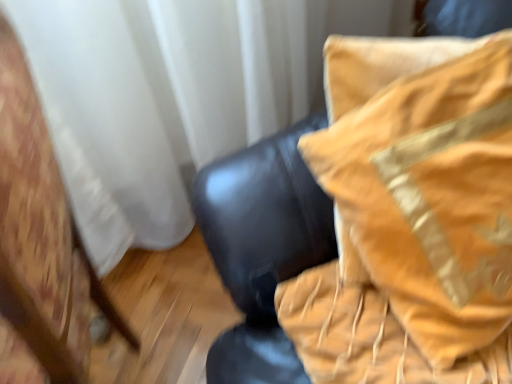
Question: In the image, is wooden chair at left, which is the 2th furniture in right-to-left order, on the left side or the right side of velvet gold pillow at upper right, the 2th furniture when ordered from left to right?

Choices:
 (A) right
 (B) left

Answer: (B)

Question: Looking at the image, does wooden chair at left, which is the 2th furniture in right-to-left order, seem bigger or smaller compared to velvet gold pillow at upper right, the first furniture from the right?

Choices:
 (A) small
 (B) big

Answer: (B)

Question: Considering the positions of wooden chair at left, placed as the 1th furniture when sorted from left to right, and velvet gold pillow at upper right, the first furniture from the right, in the image, is wooden chair at left, placed as the 1th furniture when sorted from left to right, wider or thinner than velvet gold pillow at upper right, the first furniture from the right,?

Choices:
 (A) thin
 (B) wide

Answer: (B)

Question: Is velvet gold pillow at upper right, the first furniture from the right, bigger or smaller than wooden chair at left, which is the 2th furniture in right-to-left order?

Choices:
 (A) small
 (B) big

Answer: (A)

Question: Is velvet gold pillow at upper right, the 2th furniture when ordered from left to right, wider or thinner than wooden chair at left, which is the 2th furniture in right-to-left order?

Choices:
 (A) wide
 (B) thin

Answer: (B)

Question: From a real-world perspective, is velvet gold pillow at upper right, the first furniture from the right, physically located above or below wooden chair at left, placed as the 1th furniture when sorted from left to right?

Choices:
 (A) below
 (B) above

Answer: (B)

Question: From their relative heights in the image, would you say velvet gold pillow at upper right, the 2th furniture when ordered from left to right, is taller or shorter than wooden chair at left, which is the 2th furniture in right-to-left order?

Choices:
 (A) tall
 (B) short

Answer: (B)